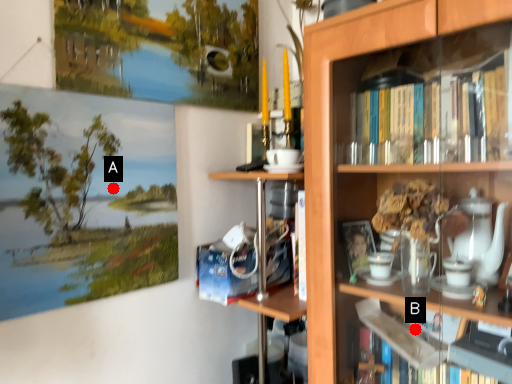
Question: Two points are circled on the image, labeled by A and B beside each circle. Which point appears farthest from the camera in this image?

Choices:
 (A) A is further
 (B) B is further

Answer: (B)